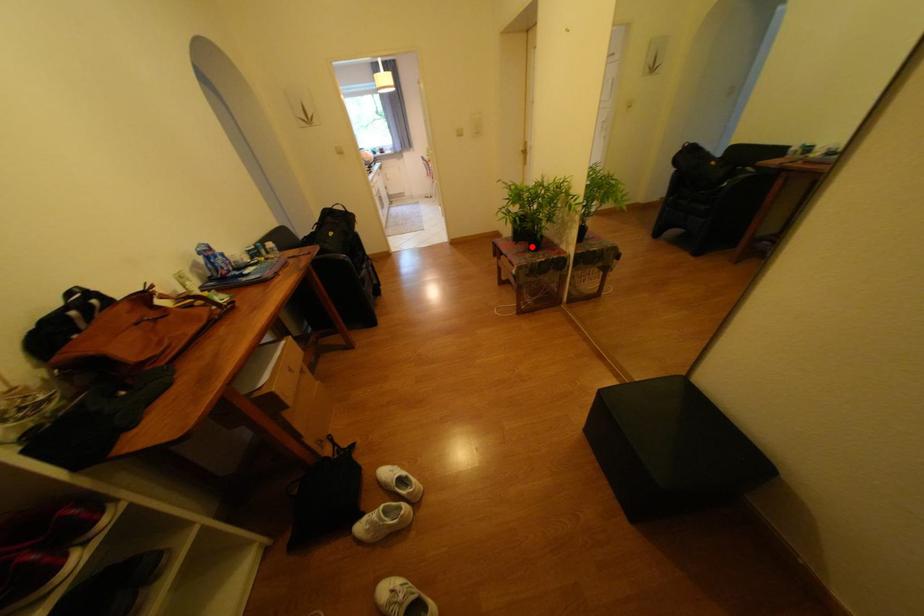
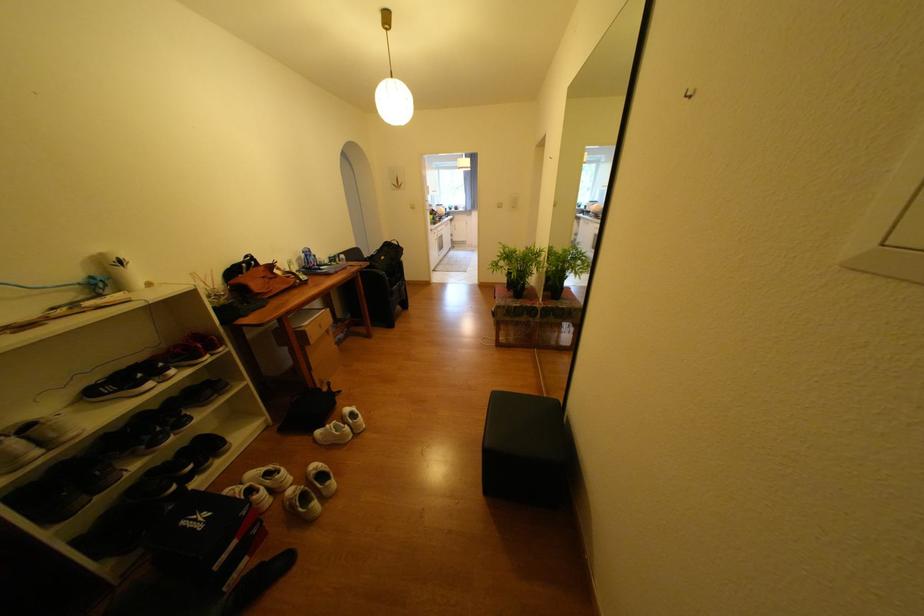
The point at the highlighted location is marked in the first image. Where is the corresponding point in the second image?

(520, 294)